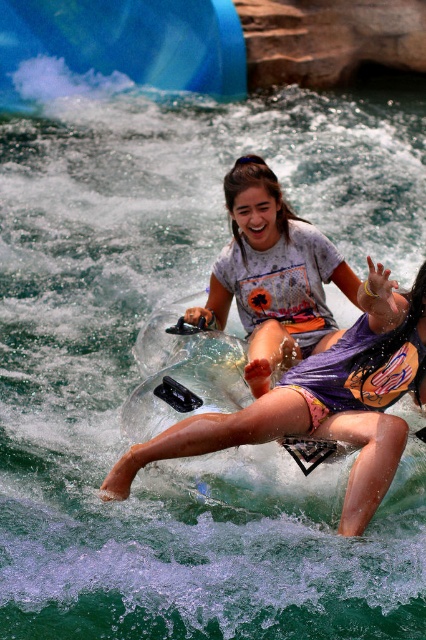
Is point (354, 513) farther from camera compared to point (2, 4)?

That is False.

Can you confirm if matte purple shorts at center is smaller than blue rubber slide at upper left?

Yes, matte purple shorts at center is smaller than blue rubber slide at upper left.

Which is in front, point (169, 436) or point (169, 88)?

Point (169, 436) is more forward.

This screenshot has height=640, width=426. I want to click on matte purple shorts at center, so click(324, 401).

Does matte purple shorts at center have a greater height compared to matte gray t-shirt at center?

In fact, matte purple shorts at center may be shorter than matte gray t-shirt at center.

Describe the element at coordinates (324, 401) in the screenshot. I see `matte purple shorts at center` at that location.

Which is behind, point (118, 496) or point (281, 362)?

Point (281, 362)

Locate an element on the screen. matte purple shorts at center is located at coordinates (324, 401).

Who is higher up, matte gray t-shirt at center or blue rubber slide at upper left?

blue rubber slide at upper left

You are a GUI agent. You are given a task and a screenshot of the screen. Output one action in this format:
    pyautogui.click(x=<x>, y=<y>)
    Task: Click on the matte gray t-shirt at center
    The width and height of the screenshot is (426, 640).
    Given the screenshot: What is the action you would take?
    pyautogui.click(x=273, y=275)